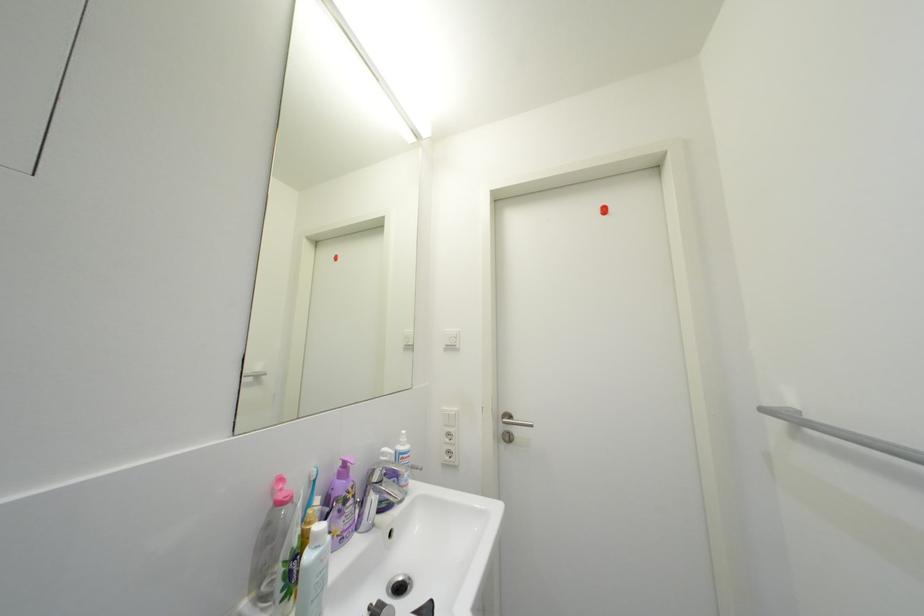
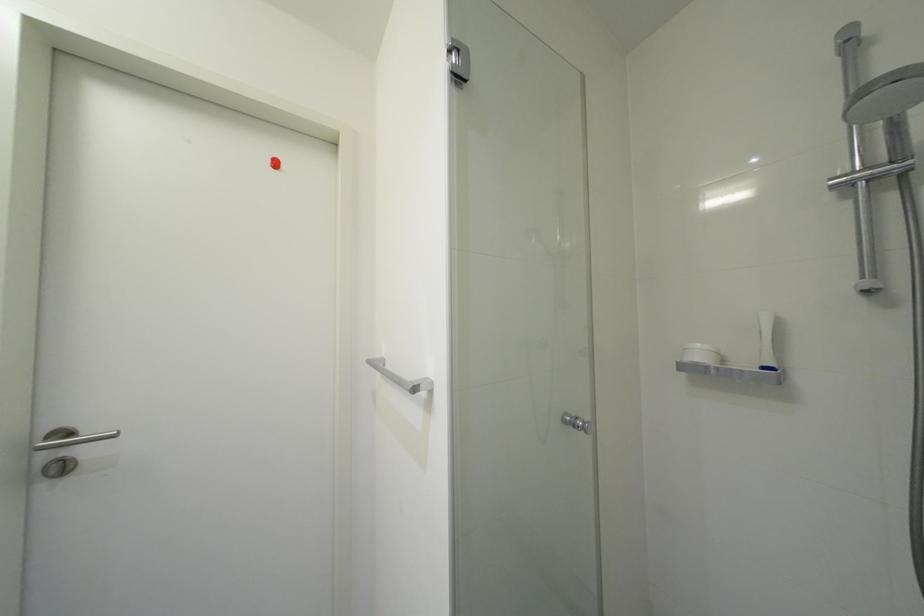
Question: The camera is either moving clockwise (left) or counter-clockwise (right) around the object. The first image is from the beginning of the video and the second image is from the end. Is the camera moving left or right when shooting the video?

Choices:
 (A) Left
 (B) Right

Answer: (A)